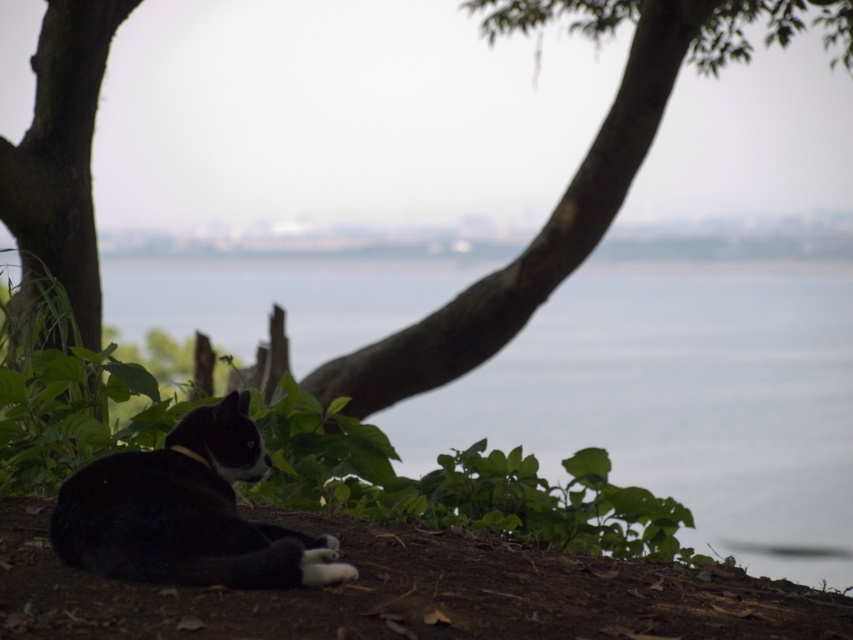
Question: Is brown rough tree trunk at center above smooth bark tree trunk at left?

Choices:
 (A) no
 (B) yes

Answer: (B)

Question: Is transparent water at center in front of black fur cat at lower left?

Choices:
 (A) no
 (B) yes

Answer: (A)

Question: Does brown rough tree trunk at center have a greater width compared to black fur cat at lower left?

Choices:
 (A) yes
 (B) no

Answer: (B)

Question: Considering the real-world distances, which object is farthest from the brown rough tree trunk at center?

Choices:
 (A) smooth bark tree trunk at left
 (B) black fur cat at lower left
 (C) transparent water at center

Answer: (B)

Question: Which point appears closest to the camera in this image?

Choices:
 (A) (677, 348)
 (B) (207, 460)

Answer: (B)

Question: Which object is positioned closest to the smooth bark tree trunk at left?

Choices:
 (A) black fur cat at lower left
 (B) transparent water at center

Answer: (A)